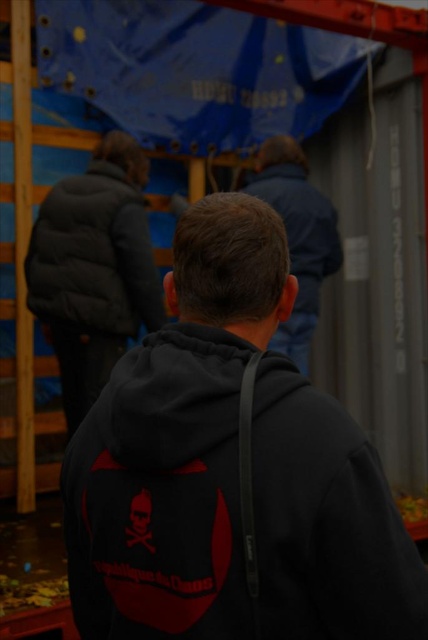
Question: Does dark gray puffy jacket at upper left appear under dark blue jacket at center?

Choices:
 (A) yes
 (B) no

Answer: (A)

Question: Is black matte hoodie at center above dark blue jacket at center?

Choices:
 (A) yes
 (B) no

Answer: (B)

Question: Estimate the real-world distances between objects in this image. Which object is closer to the black matte hoodie at center?

Choices:
 (A) dark gray puffy jacket at upper left
 (B) dark blue jacket at center

Answer: (A)

Question: Which object is farther from the camera taking this photo?

Choices:
 (A) dark gray puffy jacket at upper left
 (B) dark blue jacket at center

Answer: (B)

Question: Can you confirm if black matte hoodie at center is smaller than dark gray puffy jacket at upper left?

Choices:
 (A) yes
 (B) no

Answer: (B)

Question: Based on their relative distances, which object is farther from the dark gray puffy jacket at upper left?

Choices:
 (A) dark blue jacket at center
 (B) black matte hoodie at center

Answer: (B)